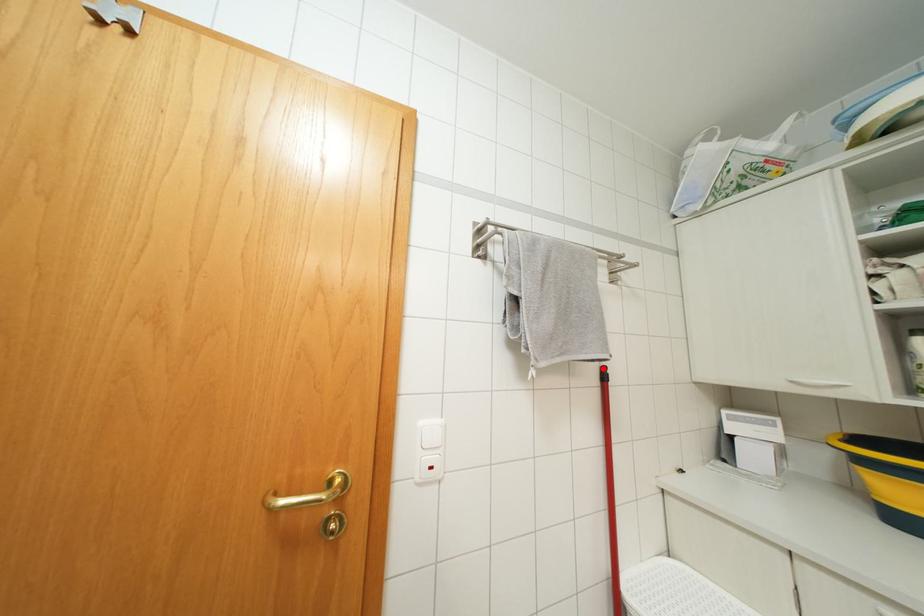
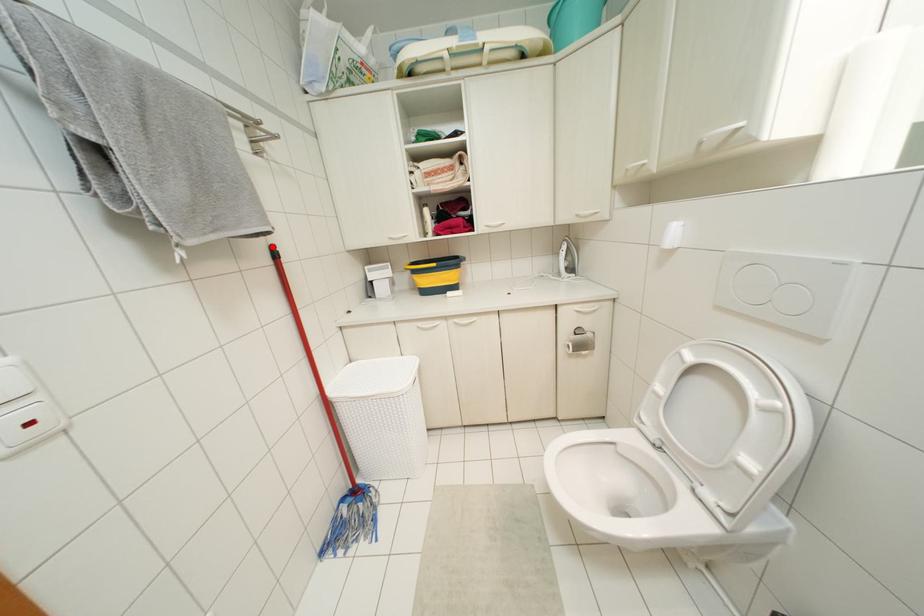
I am providing you with two images of the same scene from different viewpoints. A red point is marked on the first image and another point is marked on the second image. Are the points marked in image1 and image2 representing the same 3D position?

Yes